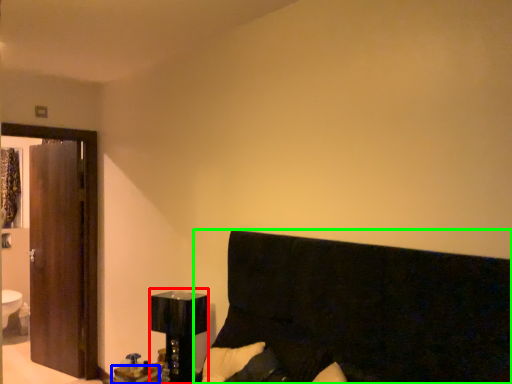
Question: Which object is positioned closest to bedside lamp (highlighted by a red box)? Select from table (highlighted by a blue box) and furniture (highlighted by a green box).

Choices:
 (A) table
 (B) furniture

Answer: (A)